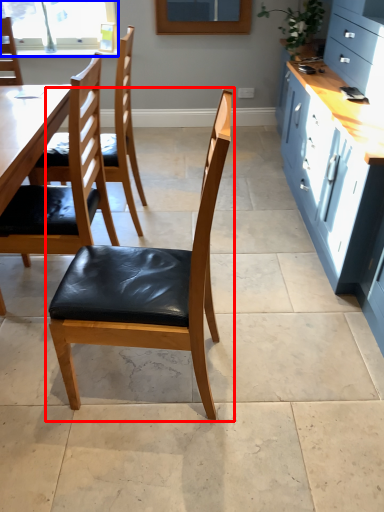
Question: Which object appears farthest to the camera in this image, chair (highlighted by a red box) or window (highlighted by a blue box)?

Choices:
 (A) chair
 (B) window

Answer: (B)